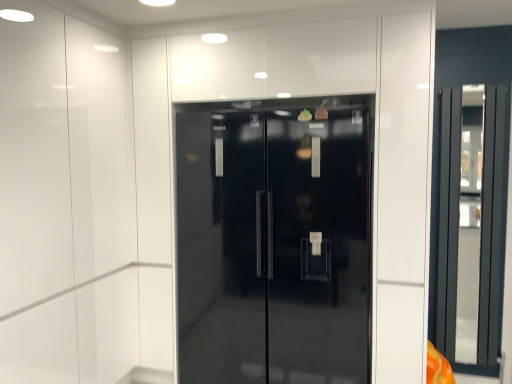
What do you see at coordinates (274, 240) in the screenshot? The height and width of the screenshot is (384, 512). I see `glossy black refrigerator at center` at bounding box center [274, 240].

Measure the distance between point (273, 318) and camera.

The depth of point (273, 318) is 8.93 feet.

In order to face glossy black refrigerator at center, should I rotate leftwards or rightwards?

Rotate your view right by about 2.534°.

This screenshot has height=384, width=512. In order to click on glossy black refrigerator at center in this screenshot , I will do `click(274, 240)`.

Where is `glossy black refrigerator at center`? The image size is (512, 384). glossy black refrigerator at center is located at coordinates (274, 240).